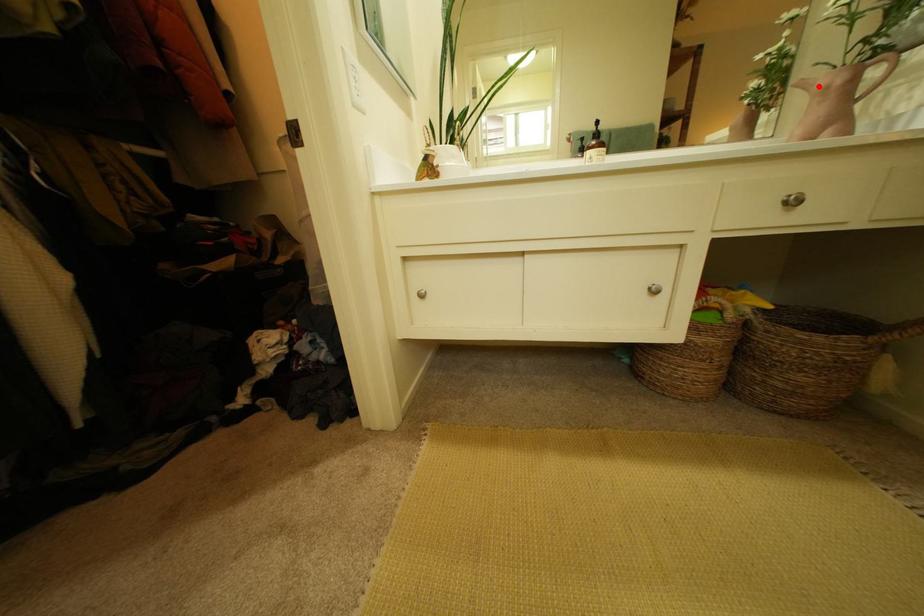
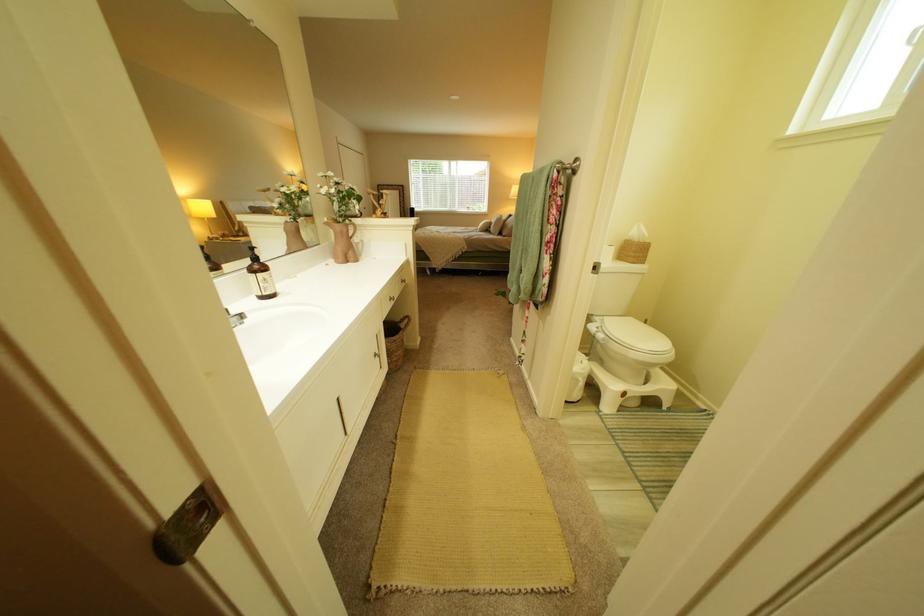
The point at the highlighted location is marked in the first image. Where is the corresponding point in the second image?

(342, 225)